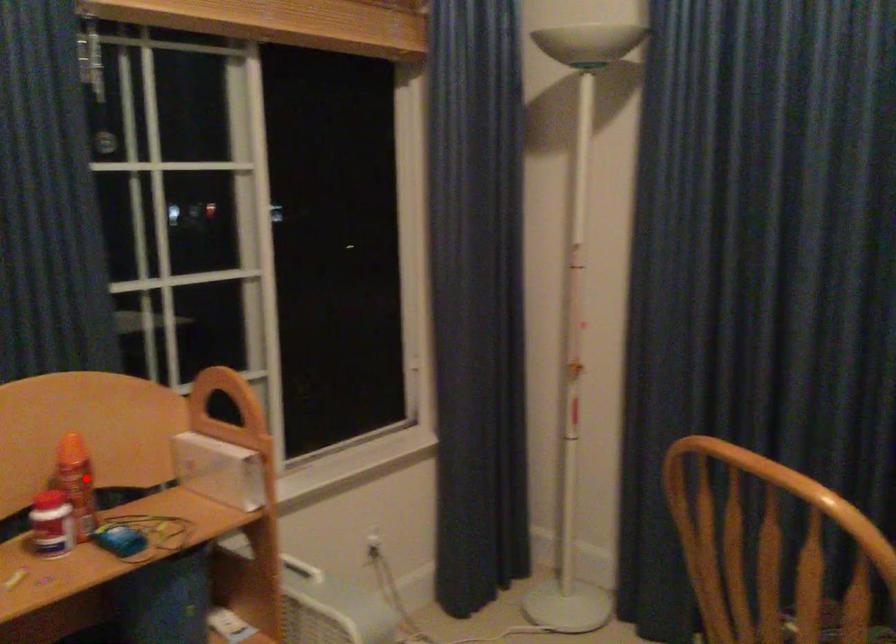
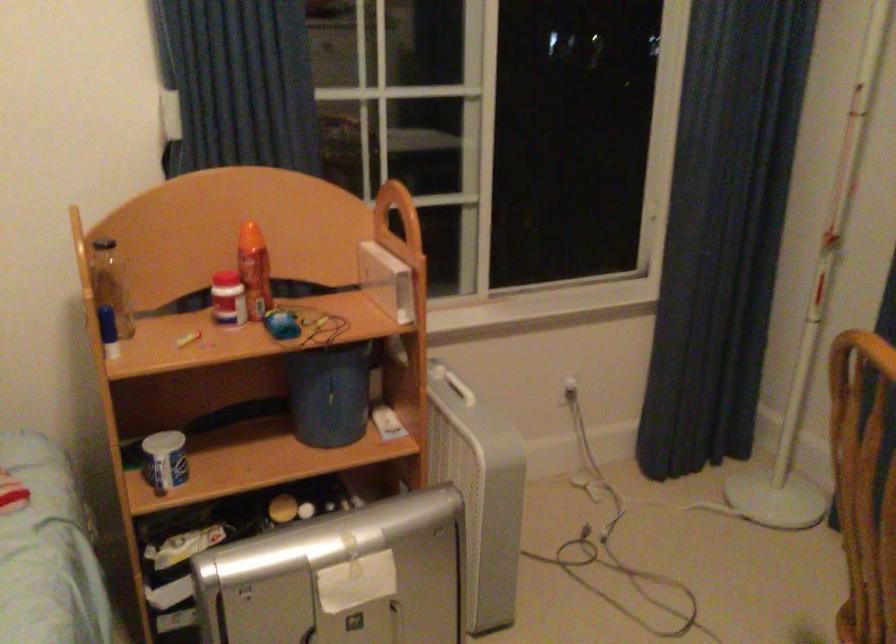
Question: I am providing you with two images of the same scene from different viewpoints. A red point is shown in image1. For the corresponding object point in image2, is it positioned nearer or farther from the camera?

Choices:
 (A) Nearer
 (B) Farther

Answer: (B)